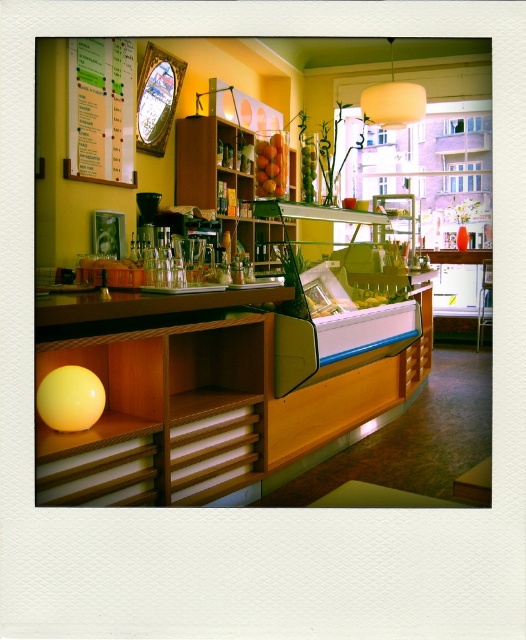
Can you confirm if white paper at upper left is positioned to the right of shiny orange fruit at center?

In fact, white paper at upper left is to the left of shiny orange fruit at center.

Can you confirm if white paper at upper left is wider than shiny orange fruit at center?

Incorrect, white paper at upper left's width does not surpass shiny orange fruit at center's.

Does point (107, 72) come closer to viewer compared to point (268, 170)?

Yes, point (107, 72) is in front of point (268, 170).

Locate an element on the screen. This screenshot has height=640, width=526. white paper at upper left is located at coordinates (100, 109).

Does matte black coffee machine at center come in front of shiny orange fruit at center?

No, it is not.

Can you confirm if matte black coffee machine at center is taller than shiny orange fruit at center?

No.

The width and height of the screenshot is (526, 640). Describe the element at coordinates (218, 330) in the screenshot. I see `matte black coffee machine at center` at that location.

The height and width of the screenshot is (640, 526). Identify the location of matte black coffee machine at center. (218, 330).

Is matte black coffee machine at center thinner than white paper at upper left?

Yes, matte black coffee machine at center is thinner than white paper at upper left.

Which of these two, matte black coffee machine at center or white paper at upper left, stands shorter?

matte black coffee machine at center

Does point (394, 148) come closer to viewer compared to point (118, 122)?

No, (394, 148) is behind (118, 122).

I want to click on matte black coffee machine at center, so click(x=218, y=330).